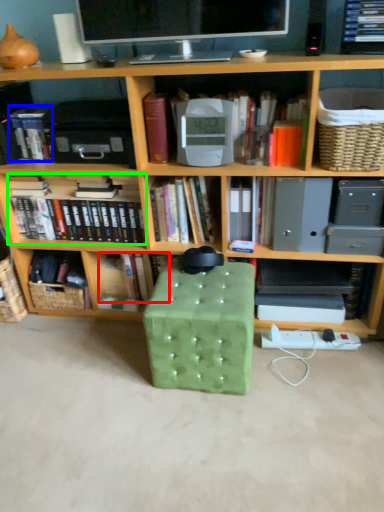
Question: Which is farther away from book (highlighted by a red box)? book (highlighted by a blue box) or book (highlighted by a green box)?

Choices:
 (A) book
 (B) book

Answer: (A)